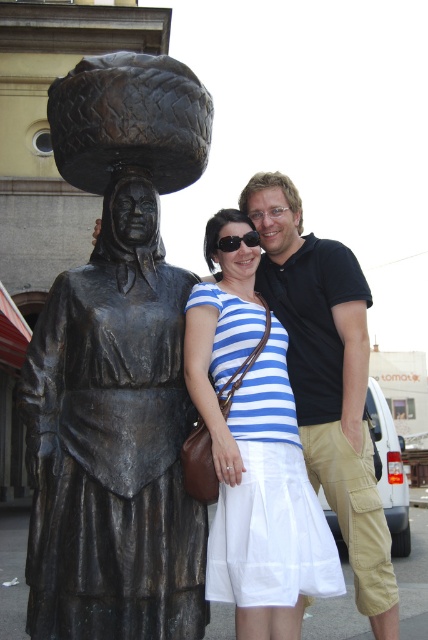
Question: Is bronze statue at left to the left of blue striped dress at center from the viewer's perspective?

Choices:
 (A) yes
 (B) no

Answer: (A)

Question: Observing the image, what is the correct spatial positioning of blue striped dress at center in reference to black plastic sunglasses at center?

Choices:
 (A) above
 (B) below

Answer: (B)

Question: Which point is farther to the camera?

Choices:
 (A) (336, 570)
 (B) (219, 248)
 (C) (107, 276)
 (D) (303, 454)

Answer: (D)

Question: Which point is farther from the camera taking this photo?

Choices:
 (A) (329, 305)
 (B) (154, 513)
 (C) (225, 244)
 (D) (252, 280)

Answer: (A)

Question: Which object is positioned farthest from the blue striped dress at center?

Choices:
 (A) black plastic sunglasses at center
 (B) black cotton polo shirt at upper right

Answer: (A)

Question: Does blue striped dress at center have a smaller size compared to black cotton polo shirt at upper right?

Choices:
 (A) no
 (B) yes

Answer: (B)